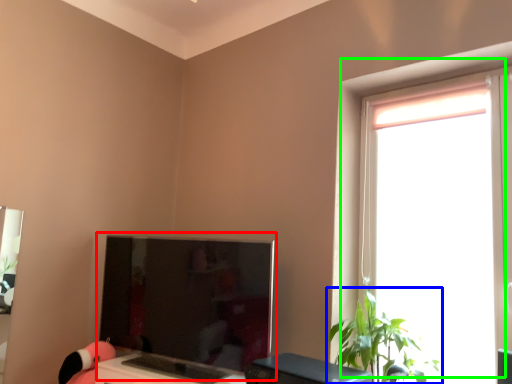
Question: Based on their relative distances, which object is farther from computer monitor (highlighted by a red box)? Choose from houseplant (highlighted by a blue box) and window (highlighted by a green box).

Choices:
 (A) houseplant
 (B) window

Answer: (B)